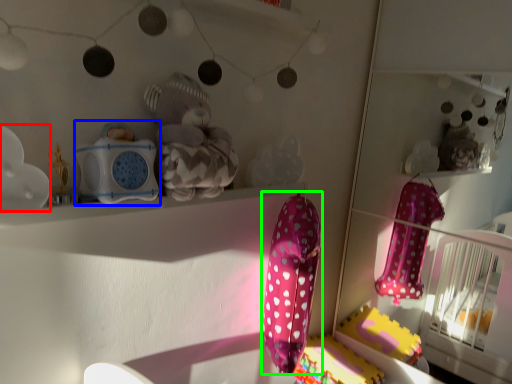
Question: Which object is positioned closest to toy (highlighted by a red box)? Select from toy (highlighted by a blue box) and baby clothe (highlighted by a green box).

Choices:
 (A) toy
 (B) baby clothe

Answer: (A)